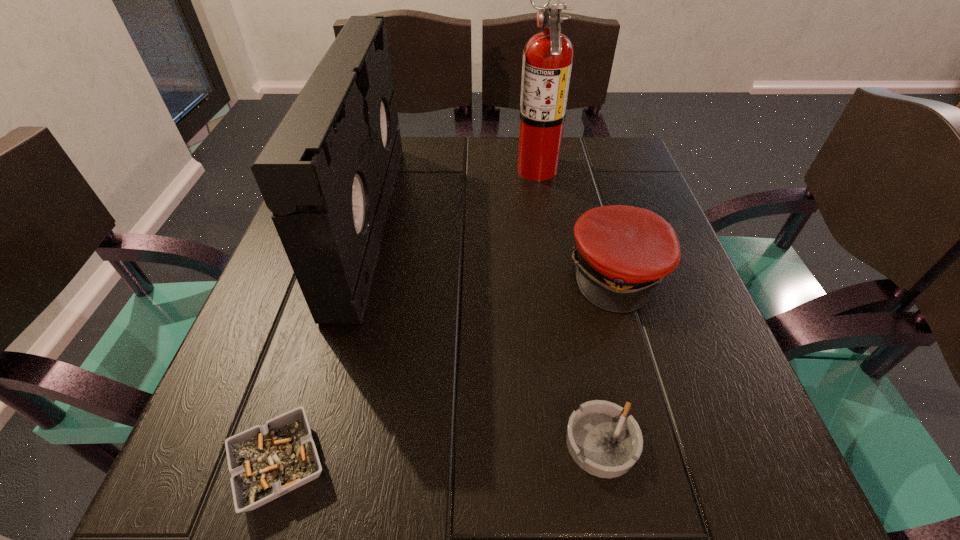
At what (x,y) coordinates should I click in order to perform the action: click on free space at the left edge of the desktop. Please return your answer as a coordinate pair (x, y). This screenshot has height=540, width=960. Looking at the image, I should click on (253, 322).

In the image, there is a desktop. Where is `vacant space at the right edge`? vacant space at the right edge is located at coordinates (659, 434).

This screenshot has height=540, width=960. In the image, there is a desktop. In order to click on free space at the far right corner in this screenshot , I will do `click(614, 151)`.

Locate an element on the screen. free space at the near right corner of the desktop is located at coordinates (766, 493).

This screenshot has height=540, width=960. In order to click on empty location between the tallest object and the left ashtray in this screenshot , I will do `click(408, 316)`.

This screenshot has height=540, width=960. Find the location of `vacant area that lies between the cap and the right ashtray`. vacant area that lies between the cap and the right ashtray is located at coordinates [610, 357].

This screenshot has width=960, height=540. In order to click on free space between the left ashtray and the videotape in this screenshot , I will do `click(324, 342)`.

The image size is (960, 540). What are the coordinates of `unoccupied position between the third tallest object and the right ashtray` in the screenshot? It's located at (610, 357).

Image resolution: width=960 pixels, height=540 pixels. In order to click on free point between the fire extinguisher and the right ashtray in this screenshot , I will do `click(569, 306)`.

This screenshot has width=960, height=540. Find the location of `vacant space that is in between the fire extinguisher and the right ashtray`. vacant space that is in between the fire extinguisher and the right ashtray is located at coordinates [569, 306].